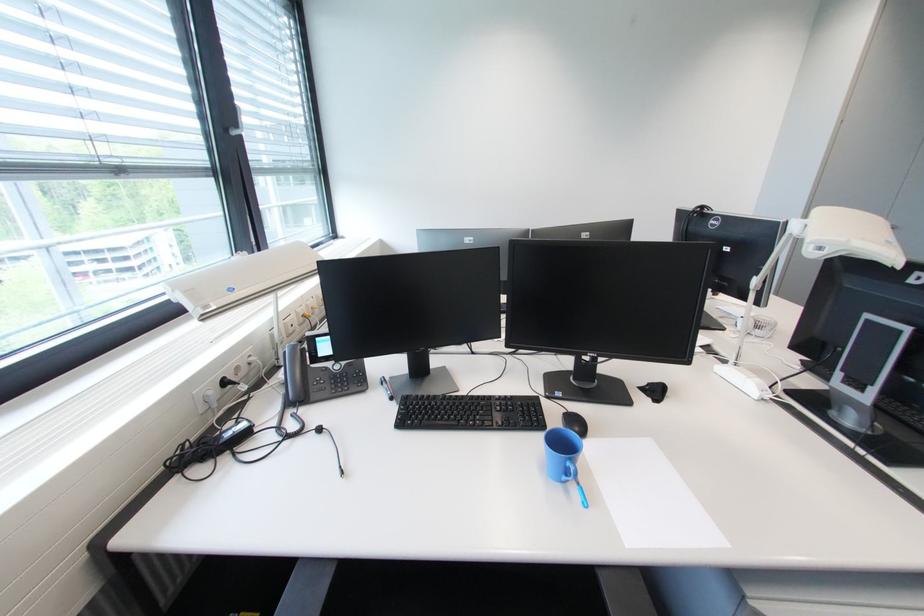
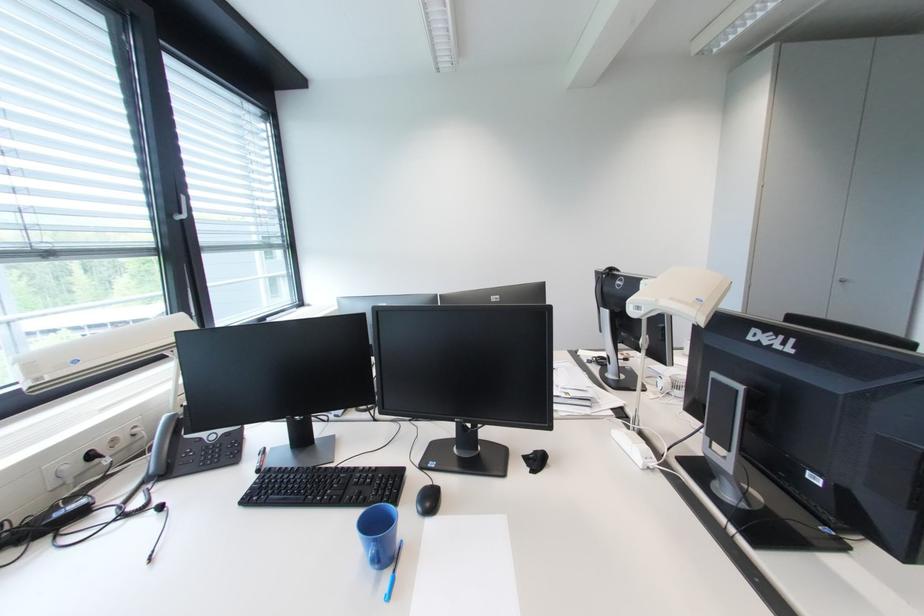
Find the pixel in the second image that matches point 579,488 in the first image.

(394, 577)